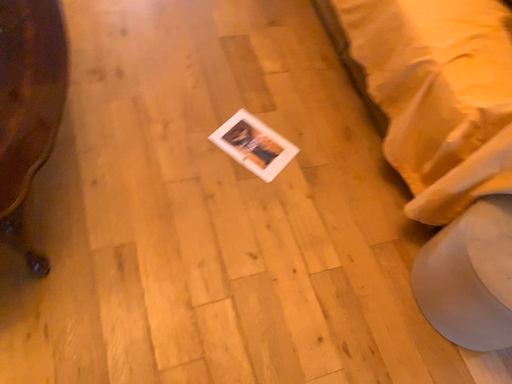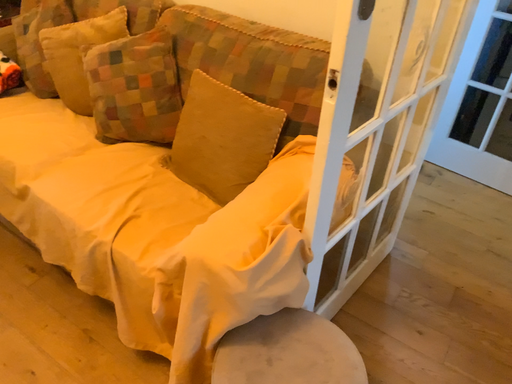
Question: How did the camera likely rotate when shooting the video?

Choices:
 (A) rotated right
 (B) rotated left

Answer: (A)